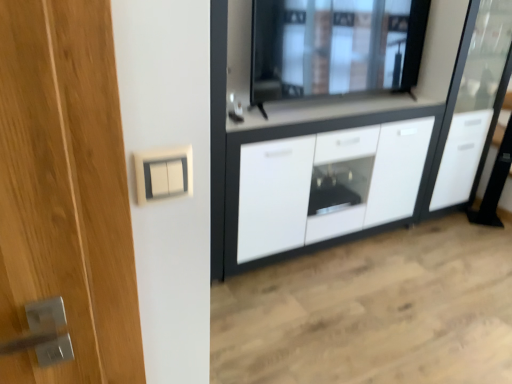
Question: Does white glossy cabinet at center have a smaller size compared to white glossy cabinet at right?

Choices:
 (A) yes
 (B) no

Answer: (B)

Question: Is white glossy cabinet at right located within white glossy cabinet at center?

Choices:
 (A) no
 (B) yes

Answer: (A)

Question: Is white glossy cabinet at center further to camera compared to white glossy cabinet at right?

Choices:
 (A) yes
 (B) no

Answer: (B)

Question: From a real-world perspective, is white glossy cabinet at center physically below white glossy cabinet at right?

Choices:
 (A) yes
 (B) no

Answer: (A)

Question: From the image's perspective, is white glossy cabinet at center on top of white glossy cabinet at right?

Choices:
 (A) yes
 (B) no

Answer: (B)

Question: Is white glossy cabinet at center inside the boundaries of white glossy cabinet at right, or outside?

Choices:
 (A) outside
 (B) inside

Answer: (A)

Question: From a real-world perspective, is white glossy cabinet at center physically located above or below white glossy cabinet at right?

Choices:
 (A) above
 (B) below

Answer: (B)

Question: In terms of height, does white glossy cabinet at center look taller or shorter compared to white glossy cabinet at right?

Choices:
 (A) short
 (B) tall

Answer: (A)

Question: Is point (271, 165) positioned closer to the camera than point (456, 173)?

Choices:
 (A) farther
 (B) closer

Answer: (B)

Question: Relative to transparent glass window at upper center, is white glossy cabinet at center in front or behind?

Choices:
 (A) behind
 (B) front

Answer: (A)

Question: Is point (309, 173) closer or farther from the camera than point (387, 81)?

Choices:
 (A) farther
 (B) closer

Answer: (B)

Question: Based on their sizes in the image, would you say white glossy cabinet at center is bigger or smaller than transparent glass window at upper center?

Choices:
 (A) big
 (B) small

Answer: (A)

Question: Considering the relative positions of white glossy cabinet at center and transparent glass window at upper center in the image provided, is white glossy cabinet at center to the left or to the right of transparent glass window at upper center?

Choices:
 (A) right
 (B) left

Answer: (B)

Question: From the image's perspective, is white glossy cabinet at center positioned above or below white plastic switch at upper center?

Choices:
 (A) above
 (B) below

Answer: (A)

Question: Based on their sizes in the image, would you say white glossy cabinet at center is bigger or smaller than white plastic switch at upper center?

Choices:
 (A) small
 (B) big

Answer: (B)